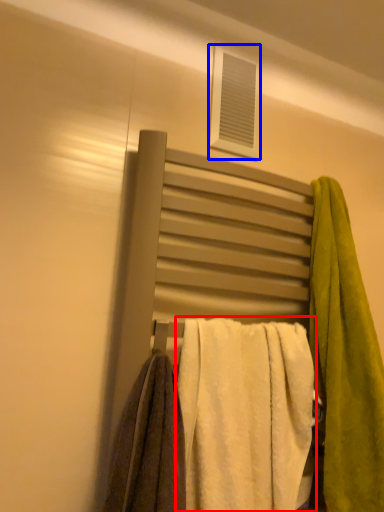
Question: Among these objects, which one is farthest to the camera, towel (highlighted by a red box) or window (highlighted by a blue box)?

Choices:
 (A) towel
 (B) window

Answer: (B)